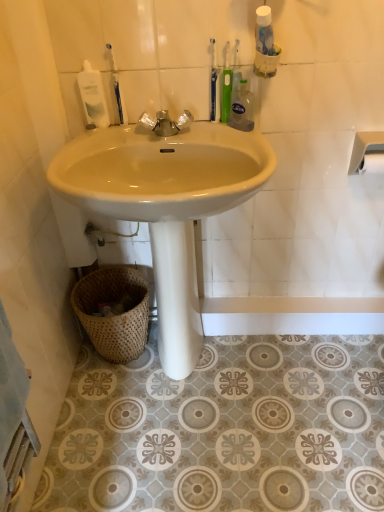
Question: From their relative heights in the image, would you say matte ceramic sink at center is taller or shorter than white glossy mouthwash at upper left?

Choices:
 (A) short
 (B) tall

Answer: (B)

Question: Considering the positions of matte ceramic sink at center and white glossy mouthwash at upper left in the image, is matte ceramic sink at center bigger or smaller than white glossy mouthwash at upper left?

Choices:
 (A) small
 (B) big

Answer: (B)

Question: Considering the real-world distances, which object is closest to the matte ceramic sink at center?

Choices:
 (A) green plastic toothbrush at upper center, the third toothbrush when ordered from left to right
 (B) clear liquid soap at upper center
 (C) white plastic towel bar at upper right
 (D) white matte toilet paper at right
 (E) green plastic toothbrush at upper center, positioned as the 1th toothbrush in right-to-left order

Answer: (B)

Question: Estimate the real-world distances between objects in this image. Which object is farther from the blue plastic toothbrush at upper center, which is the second toothbrush from left to right?

Choices:
 (A) white glossy mouthwash at upper left
 (B) matte ceramic sink at center
 (C) blue plastic toothbrush at upper left, marked as the first toothbrush in a left-to-right arrangement
 (D) white matte toilet paper at right
 (E) green plastic toothbrush at upper center, the third toothbrush when ordered from left to right

Answer: (D)